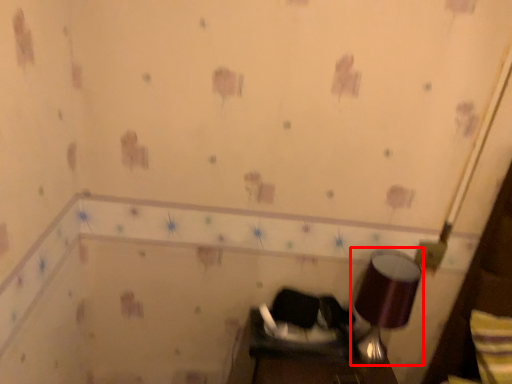
Question: From the image's perspective, where is lamp (annotated by the red box) located relative to swivel chair?

Choices:
 (A) below
 (B) above

Answer: (B)